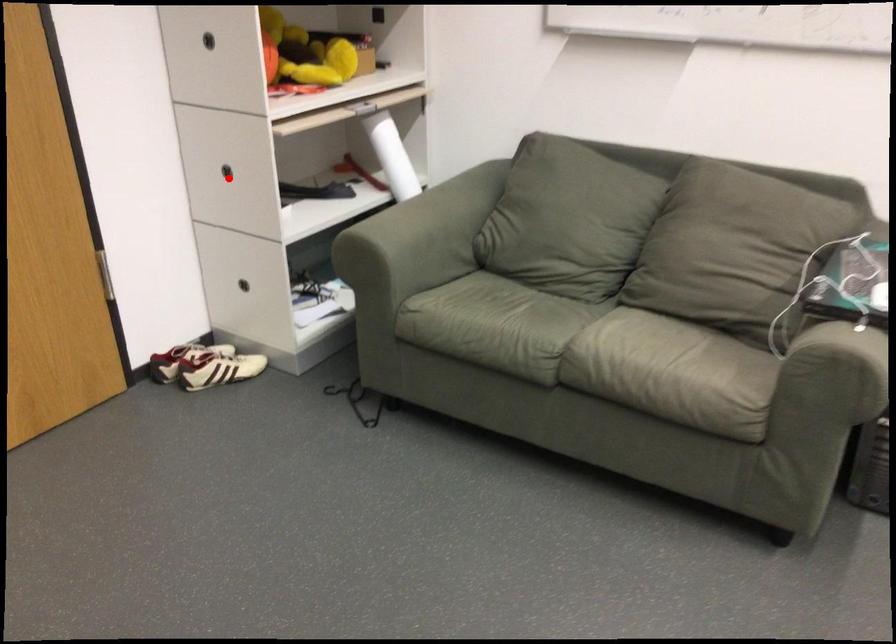
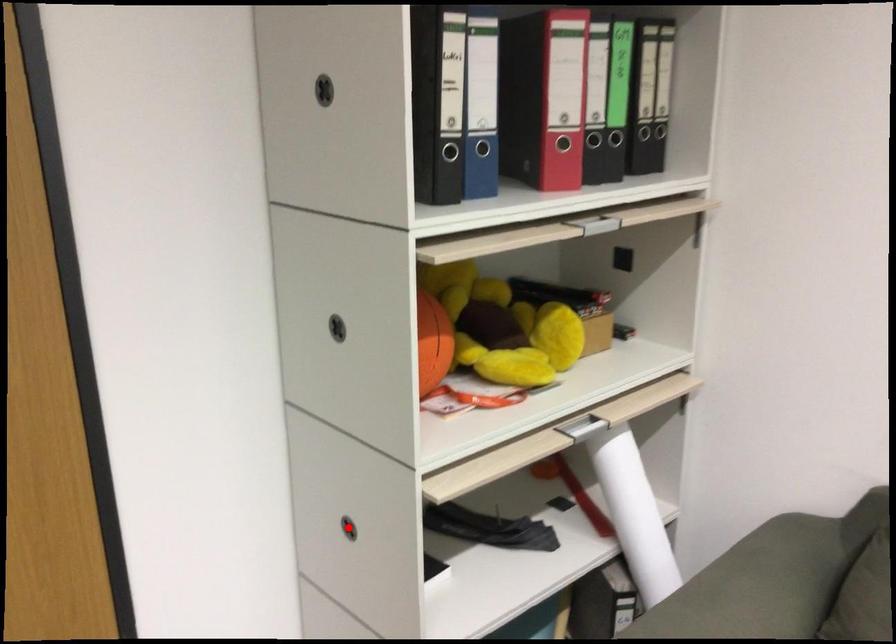
Looking at this image, I am providing you with two images of the same scene from different viewpoints. A red point is marked on the first image and another point is marked on the second image. Is the marked point in image1 the same physical position as the marked point in image2?

Yes